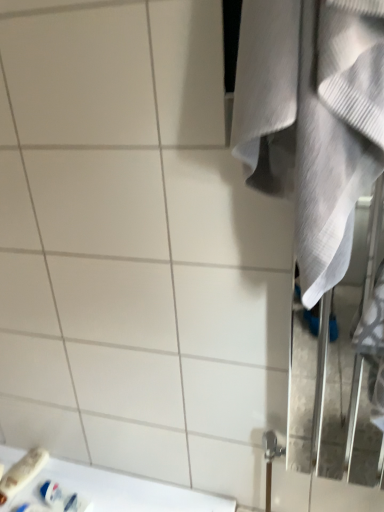
Question: Considering the relative sizes of white glossy counter top at lower left and white plastic toothpaste tube at lower left, which is the first toiletry in right-to-left order, in the image provided, is white glossy counter top at lower left bigger than white plastic toothpaste tube at lower left, which is the first toiletry in right-to-left order,?

Choices:
 (A) yes
 (B) no

Answer: (A)

Question: Would you say white glossy counter top at lower left is a long distance from white plastic toothpaste tube at lower left, which is the first toiletry in right-to-left order?

Choices:
 (A) yes
 (B) no

Answer: (B)

Question: Is white glossy counter top at lower left to the right of white plastic toothpaste tube at lower left, which is the first toiletry in right-to-left order, from the viewer's perspective?

Choices:
 (A) no
 (B) yes

Answer: (B)

Question: Is white glossy counter top at lower left beside white plastic toothpaste tube at lower left, which is the first toiletry in right-to-left order?

Choices:
 (A) no
 (B) yes

Answer: (A)

Question: Considering the relative sizes of white glossy counter top at lower left and white plastic toothpaste tube at lower left, which is the first toiletry in right-to-left order, in the image provided, is white glossy counter top at lower left shorter than white plastic toothpaste tube at lower left, which is the first toiletry in right-to-left order,?

Choices:
 (A) yes
 (B) no

Answer: (A)

Question: Is white glossy counter top at lower left taller than white plastic toothpaste tube at lower left, which is the 2th toiletry in left-to-right order?

Choices:
 (A) yes
 (B) no

Answer: (B)

Question: From the image's perspective, is white glossy counter top at lower left over white plastic toothbrush at lower left, the second toiletry positioned from the right?

Choices:
 (A) no
 (B) yes

Answer: (A)

Question: Is white glossy counter top at lower left turned away from white plastic toothbrush at lower left, which ranks as the first toiletry in left-to-right order?

Choices:
 (A) no
 (B) yes

Answer: (A)

Question: From a real-world perspective, is white glossy counter top at lower left over white plastic toothbrush at lower left, which ranks as the first toiletry in left-to-right order?

Choices:
 (A) yes
 (B) no

Answer: (B)

Question: Considering the relative sizes of white glossy counter top at lower left and white plastic toothbrush at lower left, the second toiletry positioned from the right, in the image provided, is white glossy counter top at lower left taller than white plastic toothbrush at lower left, the second toiletry positioned from the right,?

Choices:
 (A) yes
 (B) no

Answer: (B)

Question: Does white glossy counter top at lower left have a smaller size compared to white plastic toothbrush at lower left, which ranks as the first toiletry in left-to-right order?

Choices:
 (A) yes
 (B) no

Answer: (B)

Question: From a real-world perspective, is white glossy counter top at lower left physically below white plastic toothbrush at lower left, the second toiletry positioned from the right?

Choices:
 (A) yes
 (B) no

Answer: (A)

Question: Can you confirm if white plastic toothbrush at lower left, the second toiletry positioned from the right, is bigger than white textured towel at right?

Choices:
 (A) yes
 (B) no

Answer: (B)